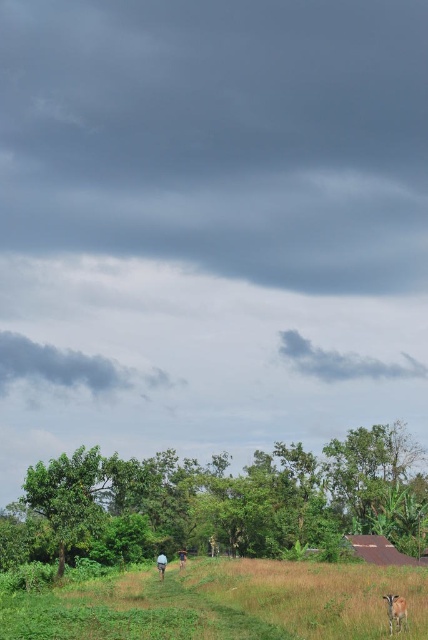
Who is positioned more to the left, green leafy tree at lower center or brown fur goat at lower right?

green leafy tree at lower center

Does green leafy tree at lower center have a lesser height compared to brown fur goat at lower right?

In fact, green leafy tree at lower center may be taller than brown fur goat at lower right.

Between point (275, 545) and point (398, 627), which one is positioned behind?

The point (275, 545) is more distant.

The width and height of the screenshot is (428, 640). I want to click on green leafy tree at lower center, so click(x=219, y=502).

Does brown fur goat at lower right appear over blue fabric person at center?

Indeed, brown fur goat at lower right is positioned over blue fabric person at center.

Does brown fur goat at lower right have a smaller size compared to blue fabric person at center?

Indeed, brown fur goat at lower right has a smaller size compared to blue fabric person at center.

Between point (389, 616) and point (158, 554), which one is positioned behind?

Positioned behind is point (158, 554).

The height and width of the screenshot is (640, 428). Find the location of `brown fur goat at lower right`. brown fur goat at lower right is located at coordinates (395, 611).

Between blue fabric person at center and blue fabric person at lower center, which one has more height?

blue fabric person at center

Does blue fabric person at center have a smaller size compared to blue fabric person at lower center?

Actually, blue fabric person at center might be larger than blue fabric person at lower center.

Measure the distance between point (163, 561) and camera.

Point (163, 561) and camera are 54.67 meters apart.

This screenshot has width=428, height=640. Identify the location of blue fabric person at center. (160, 564).